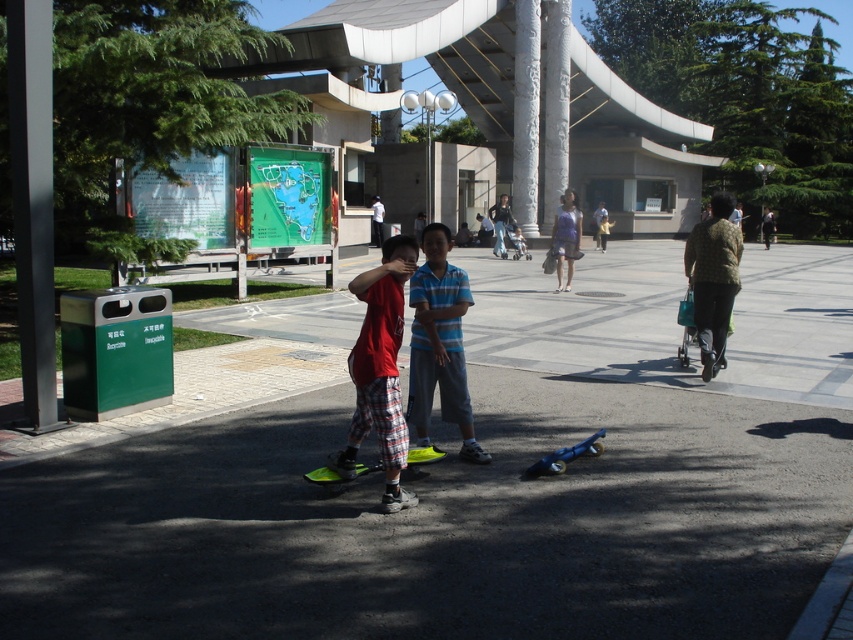
Question: Can you confirm if dark gray asphalt at center is bigger than purple fabric dress at center?

Choices:
 (A) no
 (B) yes

Answer: (B)

Question: Which object appears farthest from the camera in this image?

Choices:
 (A) green plastic skateboard at lower center
 (B) dark gray asphalt at center
 (C) dark blue jeans at center
 (D) blue striped shirt at center

Answer: (C)

Question: Is purple fabric dress at center thinner than blue metallic skateboard at lower center?

Choices:
 (A) no
 (B) yes

Answer: (A)

Question: Can you confirm if blue striped shirt at center is positioned below green plastic skateboard at lower center?

Choices:
 (A) no
 (B) yes

Answer: (A)

Question: Which object is positioned farthest from the blue metallic skateboard at lower center?

Choices:
 (A) green textured sweater at right
 (B) purple fabric dress at center

Answer: (B)

Question: Estimate the real-world distances between objects in this image. Which object is closer to the purple fabric dress at center?

Choices:
 (A) green plastic skateboard at lower center
 (B) blue striped shirt at center
 (C) dark gray asphalt at center

Answer: (C)